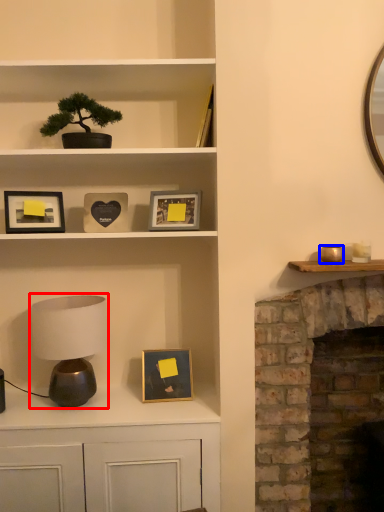
Question: Which of the following is the closest to the observer, table lamp (highlighted by a red box) or candle holder (highlighted by a blue box)?

Choices:
 (A) table lamp
 (B) candle holder

Answer: (B)